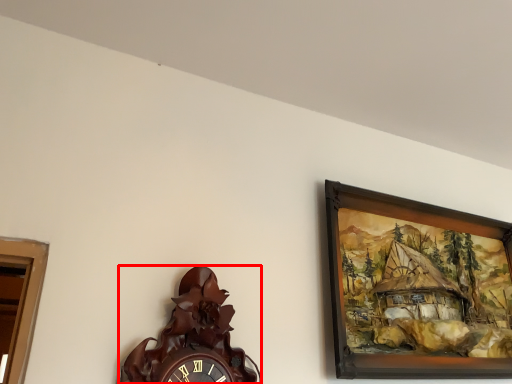
Question: Observing the image, what is the correct spatial positioning of wall clock (annotated by the red box) in reference to picture frame?

Choices:
 (A) left
 (B) right

Answer: (A)